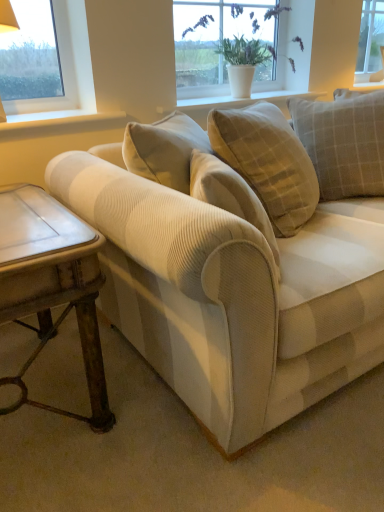
At what (x,y) coordinates should I click in order to perform the action: click on blank space situated above rustic wood side table at lower left (from a real-world perspective). Please return your answer as a coordinate pair (x, y). Image resolution: width=384 pixels, height=512 pixels. Looking at the image, I should click on click(28, 217).